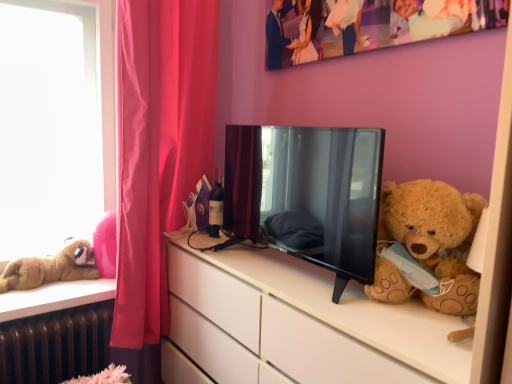
Question: From a real-world perspective, relative to white matte cabinet at right, is matte pink curtain at left vertically above or below?

Choices:
 (A) below
 (B) above

Answer: (B)

Question: Is matte pink curtain at left inside or outside of white matte cabinet at right?

Choices:
 (A) outside
 (B) inside

Answer: (A)

Question: Considering the real-world distances, which object is closest to the matte glass bottle at center?

Choices:
 (A) matte pink curtain at left
 (B) brown metallic radiator at lower left
 (C) pink rubber ball at left
 (D) black glossy tv at center
 (E) white matte cabinet at right

Answer: (A)

Question: Estimate the real-world distances between objects in this image. Which object is closer to the pink rubber ball at left?

Choices:
 (A) matte pink curtain at left
 (B) black glossy tv at center
 (C) brown metallic radiator at lower left
 (D) fluffy brown teddy bear at right, the 2th teddy bear when ordered from left to right
 (E) matte glass bottle at center

Answer: (C)